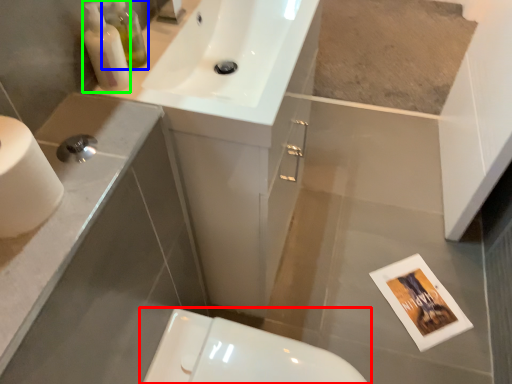
Question: Estimate the real-world distances between objects in this image. Which object is farther from toilet (highlighted by a red box), toiletry (highlighted by a blue box) or soap dispenser (highlighted by a green box)?

Choices:
 (A) toiletry
 (B) soap dispenser

Answer: (A)